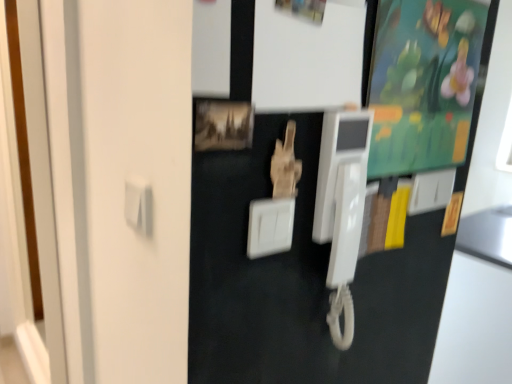
Question: Considering the relative sizes of white plastic light switch at upper right, acting as the 2th light switch starting from the left, and wooden photo frame at center in the image provided, is white plastic light switch at upper right, acting as the 2th light switch starting from the left, wider than wooden photo frame at center?

Choices:
 (A) no
 (B) yes

Answer: (A)

Question: Can you confirm if white plastic light switch at upper right, acting as the 2th light switch starting from the left, is positioned to the left of wooden photo frame at center?

Choices:
 (A) no
 (B) yes

Answer: (A)

Question: Does white plastic light switch at upper right, the second light switch viewed from the front, touch wooden photo frame at center?

Choices:
 (A) no
 (B) yes

Answer: (A)

Question: Is white plastic light switch at upper right, which ranks as the 1th light switch in right-to-left order, not inside wooden photo frame at center?

Choices:
 (A) no
 (B) yes

Answer: (B)

Question: From the image's perspective, does white plastic light switch at upper right, the first light switch positioned from the back, appear higher than wooden photo frame at center?

Choices:
 (A) yes
 (B) no

Answer: (B)

Question: Is white plastic light switch at center, the 2th light switch viewed from the back, wider or thinner than white plastic light switch at upper right, the second light switch viewed from the front?

Choices:
 (A) thin
 (B) wide

Answer: (B)

Question: Considering their positions, is white plastic light switch at center, which is counted as the 1th light switch, starting from the front, located in front of or behind white plastic light switch at upper right, the first light switch positioned from the back?

Choices:
 (A) front
 (B) behind

Answer: (A)

Question: Looking at the image, does white plastic light switch at center, the 2th light switch viewed from the back, seem bigger or smaller compared to white plastic light switch at upper right, the first light switch positioned from the back?

Choices:
 (A) small
 (B) big

Answer: (A)

Question: Considering the relative positions of white plastic light switch at center, which is counted as the 1th light switch, starting from the front, and white plastic light switch at upper right, the first light switch positioned from the back, in the image provided, is white plastic light switch at center, which is counted as the 1th light switch, starting from the front, to the left or to the right of white plastic light switch at upper right, the first light switch positioned from the back,?

Choices:
 (A) left
 (B) right

Answer: (A)

Question: Is white plastic light switch at center, acting as the 2th light switch starting from the right, in front of or behind green matte bulletin board at upper right in the image?

Choices:
 (A) front
 (B) behind

Answer: (A)

Question: Does point (284, 196) appear closer or farther from the camera than point (442, 127)?

Choices:
 (A) closer
 (B) farther

Answer: (A)

Question: From the image's perspective, is white plastic light switch at center, the 2th light switch viewed from the back, located above or below green matte bulletin board at upper right?

Choices:
 (A) above
 (B) below

Answer: (B)

Question: Considering the positions of white plastic light switch at center, the 2th light switch viewed from the back, and green matte bulletin board at upper right in the image, is white plastic light switch at center, the 2th light switch viewed from the back, wider or thinner than green matte bulletin board at upper right?

Choices:
 (A) thin
 (B) wide

Answer: (A)

Question: Considering the positions of white plastic light switch at upper right, acting as the 2th light switch starting from the left, and white plastic light switch at center, which is counted as the first light switch, starting from the left, in the image, is white plastic light switch at upper right, acting as the 2th light switch starting from the left, bigger or smaller than white plastic light switch at center, which is counted as the first light switch, starting from the left,?

Choices:
 (A) big
 (B) small

Answer: (A)

Question: Which is correct: white plastic light switch at upper right, acting as the 2th light switch starting from the left, is inside white plastic light switch at center, acting as the 2th light switch starting from the right, or outside of it?

Choices:
 (A) inside
 (B) outside

Answer: (B)